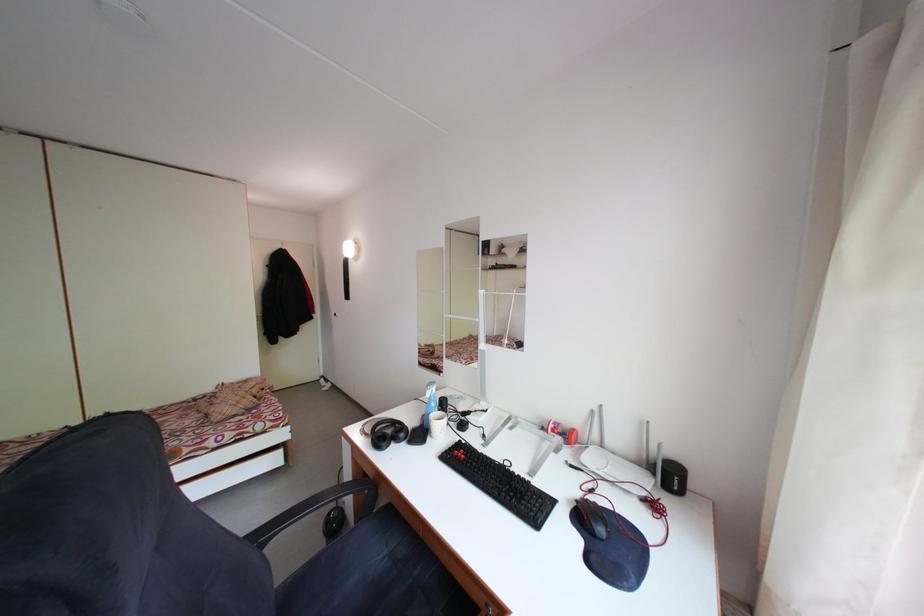
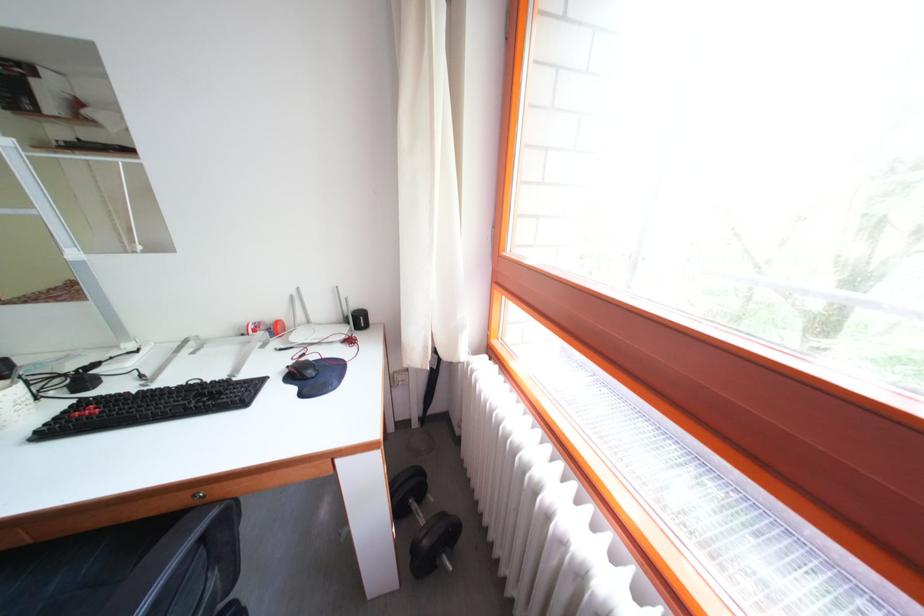
Based on the continuous images, in which direction is the camera rotating?

Result: The camera's rotation is toward right-down.